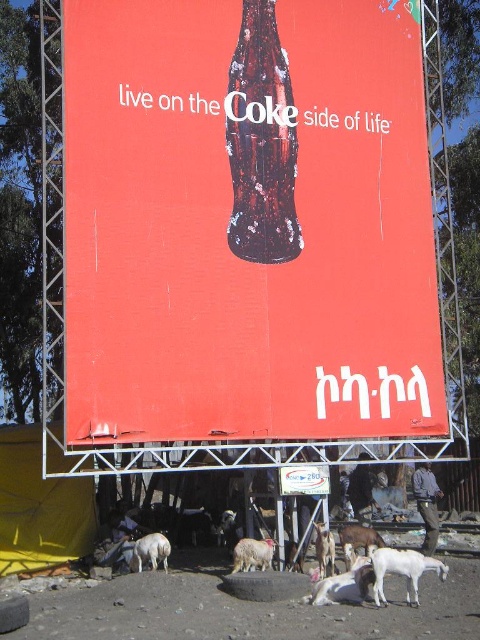
Question: Observing the image, what is the correct spatial positioning of translucent glass bottle at center in reference to white woolen sheep at lower center?

Choices:
 (A) below
 (B) above

Answer: (B)

Question: Which object is farther from the camera taking this photo?

Choices:
 (A) white woolen sheep at lower left
 (B) white woolen goat at lower right
 (C) white woolen sheep at lower center
 (D) translucent glass bottle at center

Answer: (D)

Question: Which point is closer to the camera taking this photo?

Choices:
 (A) (153, 556)
 (B) (260, 561)
 (C) (304, 429)
 (D) (352, 579)

Answer: (D)

Question: Does white woolen goat at lower right have a greater width compared to white woolen sheep at lower left?

Choices:
 (A) no
 (B) yes

Answer: (B)

Question: Among these objects, which one is farthest from the camera?

Choices:
 (A) white woolen sheep at lower left
 (B) white woolen goat at lower right

Answer: (A)

Question: Is translucent glass bottle at center positioned in front of white woolen goat at lower right?

Choices:
 (A) yes
 (B) no

Answer: (B)